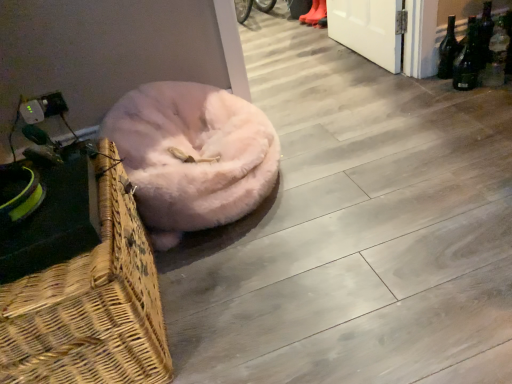
The height and width of the screenshot is (384, 512). What do you see at coordinates (314, 13) in the screenshot? I see `orange rubber boots at upper center` at bounding box center [314, 13].

The width and height of the screenshot is (512, 384). I want to click on woven wood picnic basket at lower left, so click(81, 283).

Where is `green glass bottle at right, positioned as the 1th bottle in right-to-left order`? This screenshot has height=384, width=512. green glass bottle at right, positioned as the 1th bottle in right-to-left order is located at coordinates (496, 57).

Based on the photo, is fuzzy pink dog bed at lower left further to the viewer compared to dark green glass bottle at upper right, which appears as the 2th bottle when viewed from the left?

No, it is in front of dark green glass bottle at upper right, which appears as the 2th bottle when viewed from the left.

Could you measure the distance between fuzzy pink dog bed at lower left and dark green glass bottle at upper right, the 2th bottle from the right?

fuzzy pink dog bed at lower left and dark green glass bottle at upper right, the 2th bottle from the right, are 4.27 feet apart.

Can you confirm if fuzzy pink dog bed at lower left is bigger than dark green glass bottle at upper right, the 2th bottle from the right?

Yes, fuzzy pink dog bed at lower left is bigger than dark green glass bottle at upper right, the 2th bottle from the right.

Is fuzzy pink dog bed at lower left oriented towards dark green glass bottle at upper right, the 2th bottle from the right?

No, fuzzy pink dog bed at lower left is not oriented towards dark green glass bottle at upper right, the 2th bottle from the right.

From a real-world perspective, is dark green glass bottle at upper right, marked as the 3th bottle in a right-to-left arrangement, on orange rubber boots at upper center?

Yes.

Is point (446, 55) farther from camera compared to point (305, 14)?

That is False.

Would you consider dark green glass bottle at upper right, the 1th bottle from the left, to be distant from orange rubber boots at upper center?

Yes, dark green glass bottle at upper right, the 1th bottle from the left, and orange rubber boots at upper center are quite far apart.

Is dark green glass bottle at upper right, the 1th bottle from the left, completely or partially outside of orange rubber boots at upper center?

Yes, dark green glass bottle at upper right, the 1th bottle from the left, is outside of orange rubber boots at upper center.

Do you think orange rubber boots at upper center is within woven wood picnic basket at lower left, or outside of it?

orange rubber boots at upper center is located beyond the bounds of woven wood picnic basket at lower left.

Is orange rubber boots at upper center not near woven wood picnic basket at lower left?

orange rubber boots at upper center is far away from woven wood picnic basket at lower left.

Does orange rubber boots at upper center lie in front of woven wood picnic basket at lower left?

No.

From the image's perspective, is orange rubber boots at upper center above or below woven wood picnic basket at lower left?

Clearly, from the image's perspective, orange rubber boots at upper center is above woven wood picnic basket at lower left.

Which is more to the right, woven wood picnic basket at lower left or dark green glass bottle at upper right, the 1th bottle from the left?

Positioned to the right is dark green glass bottle at upper right, the 1th bottle from the left.

Is point (113, 164) more distant than point (450, 53)?

That is False.

Can you tell me how much woven wood picnic basket at lower left and dark green glass bottle at upper right, marked as the 3th bottle in a right-to-left arrangement, differ in facing direction?

The angle between the facing direction of woven wood picnic basket at lower left and the facing direction of dark green glass bottle at upper right, marked as the 3th bottle in a right-to-left arrangement, is 149 degrees.

Between dark green glass bottle at upper right, the 1th bottle from the left, and dark green glass bottle at upper right, which appears as the 2th bottle when viewed from the left, which one has larger size?

Bigger between the two is dark green glass bottle at upper right, the 1th bottle from the left.

From a real-world perspective, between dark green glass bottle at upper right, the 1th bottle from the left, and dark green glass bottle at upper right, which appears as the 2th bottle when viewed from the left, who is vertically lower?

dark green glass bottle at upper right, the 1th bottle from the left, from a real-world perspective.

In the scene shown: Is the position of dark green glass bottle at upper right, the 1th bottle from the left, less distant than that of dark green glass bottle at upper right, which appears as the 2th bottle when viewed from the left?

Yes, dark green glass bottle at upper right, the 1th bottle from the left, is closer to the camera.

From the image's perspective, which is below, dark green glass bottle at upper right, the 1th bottle from the left, or dark green glass bottle at upper right, which appears as the 2th bottle when viewed from the left?

dark green glass bottle at upper right, the 1th bottle from the left, appears lower in the image.

Is fuzzy pink dog bed at lower left positioned beyond the bounds of woven wood picnic basket at lower left?

Yes, fuzzy pink dog bed at lower left is located beyond the bounds of woven wood picnic basket at lower left.

Considering the relative sizes of fuzzy pink dog bed at lower left and woven wood picnic basket at lower left in the image provided, is fuzzy pink dog bed at lower left thinner than woven wood picnic basket at lower left?

In fact, fuzzy pink dog bed at lower left might be wider than woven wood picnic basket at lower left.

From the picture: From the image's perspective, is green glass bottle at right, positioned as the 1th bottle in right-to-left order, on top of orange rubber boots at upper center?

No, from the image's perspective, green glass bottle at right, positioned as the 1th bottle in right-to-left order, is not above orange rubber boots at upper center.

Looking at this image, can you tell me how much green glass bottle at right, positioned as the 1th bottle in right-to-left order, and orange rubber boots at upper center differ in facing direction?

The facing directions of green glass bottle at right, positioned as the 1th bottle in right-to-left order, and orange rubber boots at upper center are 28.7 degrees apart.

Considering the positions of objects green glass bottle at right, acting as the third bottle starting from the left, and orange rubber boots at upper center in the image provided, who is more to the left, green glass bottle at right, acting as the third bottle starting from the left, or orange rubber boots at upper center?

orange rubber boots at upper center.

Looking at this image, is green glass bottle at right, positioned as the 1th bottle in right-to-left order, in contact with orange rubber boots at upper center?

green glass bottle at right, positioned as the 1th bottle in right-to-left order, is not next to orange rubber boots at upper center, and they're not touching.

This screenshot has height=384, width=512. In order to click on dog bed located below the dark green glass bottle at upper right, the 2th bottle from the right (from the image's perspective) in this screenshot , I will do `click(192, 156)`.

Where is `footwear behind the dark green glass bottle at upper right, the 1th bottle from the left`? The height and width of the screenshot is (384, 512). footwear behind the dark green glass bottle at upper right, the 1th bottle from the left is located at coordinates (314, 13).

Which object lies further to the anchor point orange rubber boots at upper center, dark green glass bottle at upper right, marked as the 3th bottle in a right-to-left arrangement, or fuzzy pink dog bed at lower left?

fuzzy pink dog bed at lower left.

From the picture: Based on their spatial positions, is orange rubber boots at upper center or dark green glass bottle at upper right, the 1th bottle from the left, closer to green glass bottle at right, acting as the third bottle starting from the left?

dark green glass bottle at upper right, the 1th bottle from the left.

Based on their spatial positions, is fuzzy pink dog bed at lower left or woven wood picnic basket at lower left further from orange rubber boots at upper center?

The object further to orange rubber boots at upper center is woven wood picnic basket at lower left.

Estimate the real-world distances between objects in this image. Which object is further from dark green glass bottle at upper right, which appears as the 2th bottle when viewed from the left, dark green glass bottle at upper right, marked as the 3th bottle in a right-to-left arrangement, or orange rubber boots at upper center?

The object further to dark green glass bottle at upper right, which appears as the 2th bottle when viewed from the left, is orange rubber boots at upper center.

Considering their positions, is dark green glass bottle at upper right, marked as the 3th bottle in a right-to-left arrangement, positioned further to fuzzy pink dog bed at lower left than green glass bottle at right, acting as the third bottle starting from the left?

green glass bottle at right, acting as the third bottle starting from the left.

From the image, which object appears to be nearer to fuzzy pink dog bed at lower left, woven wood picnic basket at lower left or orange rubber boots at upper center?

woven wood picnic basket at lower left is closer to fuzzy pink dog bed at lower left.

Based on their spatial positions, is woven wood picnic basket at lower left or fuzzy pink dog bed at lower left closer to green glass bottle at right, positioned as the 1th bottle in right-to-left order?

fuzzy pink dog bed at lower left.

Estimate the real-world distances between objects in this image. Which object is closer to green glass bottle at right, acting as the third bottle starting from the left, orange rubber boots at upper center or woven wood picnic basket at lower left?

The object closer to green glass bottle at right, acting as the third bottle starting from the left, is orange rubber boots at upper center.

Identify the location of bottle between fuzzy pink dog bed at lower left and dark green glass bottle at upper right, which appears as the 2th bottle when viewed from the left, from left to right. (448, 50).

Locate an element on the screen. dog bed between woven wood picnic basket at lower left and dark green glass bottle at upper right, marked as the 3th bottle in a right-to-left arrangement, from left to right is located at coordinates (192, 156).

I want to click on bottle situated between dark green glass bottle at upper right, the 1th bottle from the left, and green glass bottle at right, acting as the third bottle starting from the left, from left to right, so click(x=484, y=34).

The image size is (512, 384). I want to click on bottle between woven wood picnic basket at lower left and dark green glass bottle at upper right, the 2th bottle from the right, from left to right, so click(x=448, y=50).